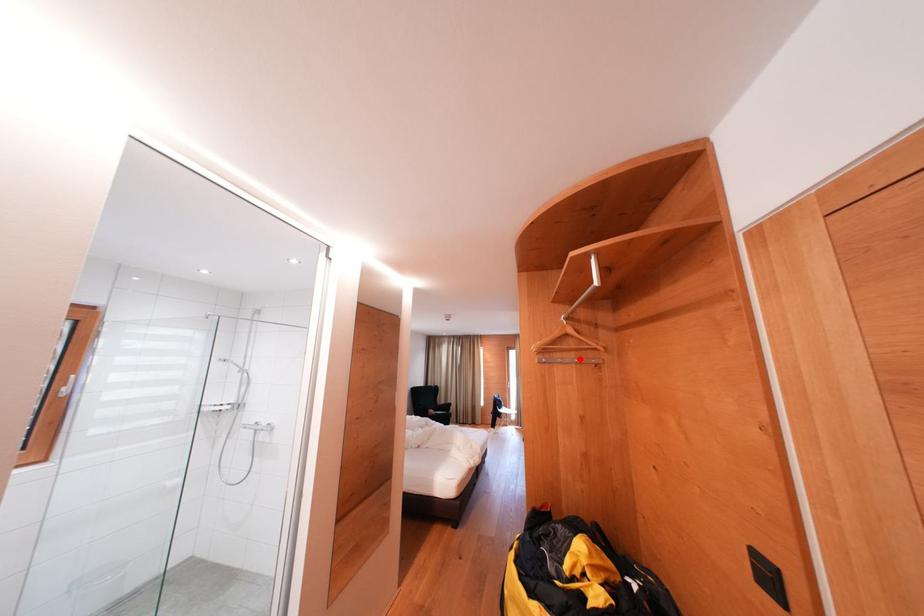
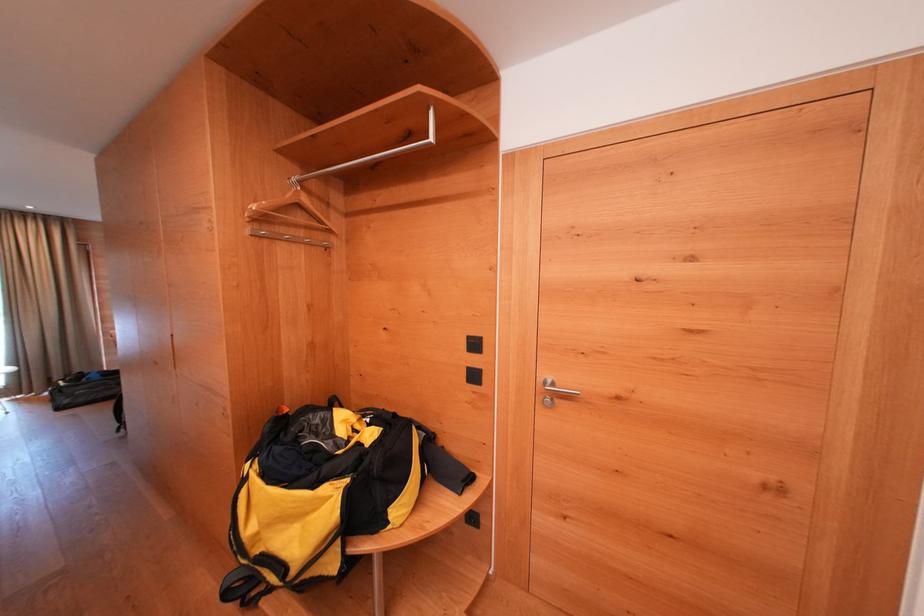
Locate, in the second image, the point that corresponds to the highlighted location in the first image.

(308, 237)